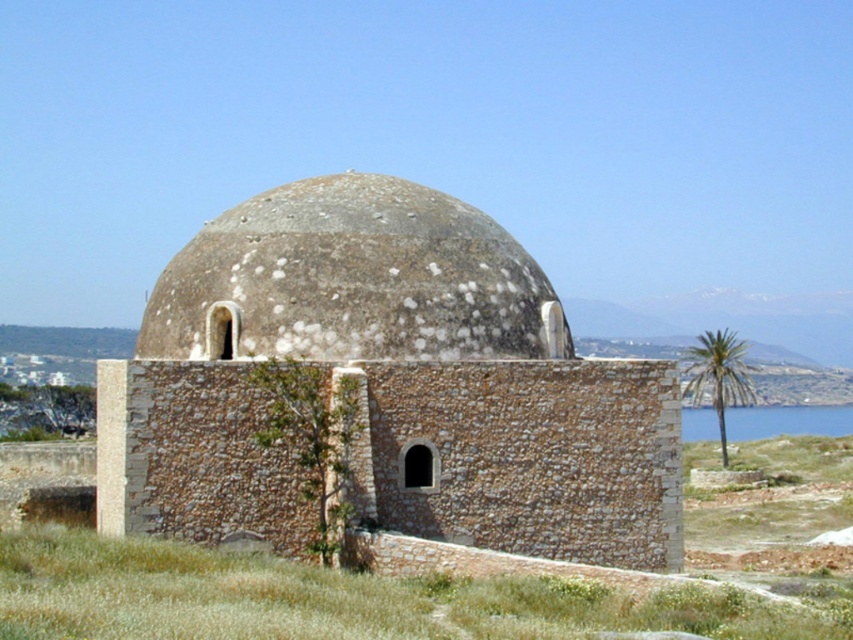
Question: Is brown stone dome at center positioned behind blue water at right?

Choices:
 (A) yes
 (B) no

Answer: (B)

Question: Does speckled stone dome at center have a smaller size compared to green leafy palm at right?

Choices:
 (A) yes
 (B) no

Answer: (A)

Question: Can you confirm if blue water at right is positioned to the right of green leafy palm at right?

Choices:
 (A) no
 (B) yes

Answer: (B)

Question: Which of the following is the closest to the observer?

Choices:
 (A) blue water at right
 (B) green leafy palm at right
 (C) speckled stone dome at center

Answer: (C)

Question: Which is nearer to the speckled stone dome at center?

Choices:
 (A) brown stone dome at center
 (B) blue water at right
 (C) green leafy palm at right

Answer: (A)

Question: Based on their relative distances, which object is farther from the blue water at right?

Choices:
 (A) speckled stone dome at center
 (B) brown stone dome at center

Answer: (A)